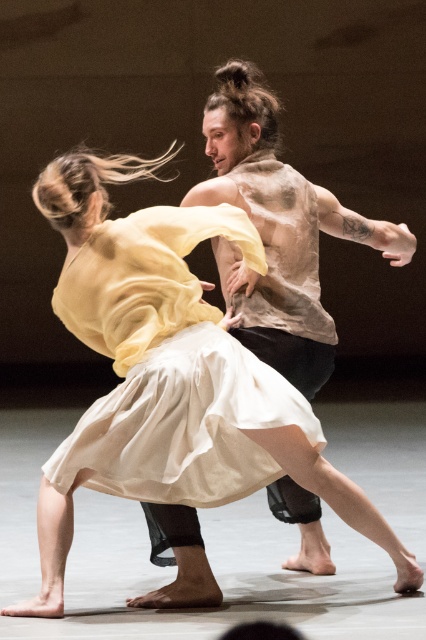
Looking at this image, you are a stagehand setting up a spotlight for the performance. The spotlight can only cover objects within a 1.5 meter diameter. Given that the matte yellow fabric at center and the translucent beige shirt at center are both at the center of the stage, will the spotlight be able to illuminate both objects simultaneously?

The matte yellow fabric at center has a larger size compared to translucent beige shirt at center. Since both are at the center of the stage, the spotlight with a 1.5 meter diameter should be able to illuminate both objects as they are positioned within the same central area and the larger fabric would still fit within the spotlight coverage.

You are a stagehand observing the dancers. You need to place a spotlight on the stage. The spotlight can only illuminate objects to its right. If you position the spotlight to the left of the matte yellow fabric at center, will it illuminate the translucent beige shirt at center?

The matte yellow fabric at center is positioned on the left side of the translucent beige shirt at center. Since the spotlight is placed to the left of the matte yellow fabric at center, the translucent beige shirt at center is to the right of the matte yellow fabric at center, so the spotlight will illuminate the translucent beige shirt at center.

You are a photographer trying to capture the dancers in the image. You want to ensure that both the matte yellow fabric at center and the translucent beige shirt at center are fully visible in your shot. Based on their widths, which object should you prioritize framing first to avoid cropping?

The matte yellow fabric at center might be wider than the translucent beige shirt at center, so you should prioritize framing the matte yellow fabric at center first to ensure it fits within the shot.